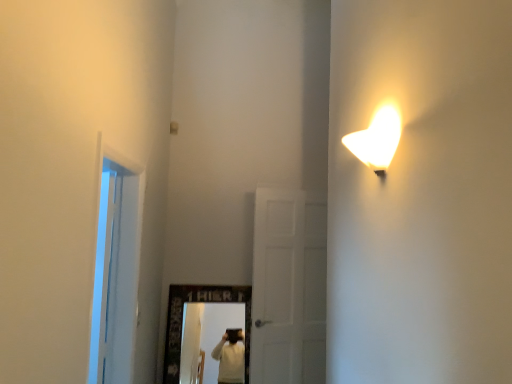
Where is `transparent glass door at left`? Image resolution: width=512 pixels, height=384 pixels. transparent glass door at left is located at coordinates (116, 271).

Measure the distance between point (124,378) and camera.

The distance of point (124,378) from camera is 7.94 feet.

Describe the element at coordinates (116, 271) in the screenshot. I see `transparent glass door at left` at that location.

Measure the distance between transparent glass door at left and camera.

The distance of transparent glass door at left from camera is 1.78 meters.

What is the approximate height of white matte door at center?

white matte door at center is 1.54 meters tall.

What do you see at coordinates (277, 286) in the screenshot?
I see `white matte door at center` at bounding box center [277, 286].

Find the location of a particular element. white matte door at center is located at coordinates (277, 286).

You are a GUI agent. You are given a task and a screenshot of the screen. Output one action in this format:
    pyautogui.click(x=<x>, y=<y>)
    Task: Click on the transparent glass door at left
    The height and width of the screenshot is (384, 512).
    Given the screenshot: What is the action you would take?
    pyautogui.click(x=116, y=271)

Which object is positioned more to the left, white matte door at center or transparent glass door at left?

transparent glass door at left is more to the left.

Does white matte door at center lie in front of transparent glass door at left?

No, white matte door at center is further to the viewer.

Which point is more forward, (300, 370) or (100, 286)?

The point (100, 286) is closer to the camera.

From the image's perspective, is white matte door at center positioned above or below transparent glass door at left?

white matte door at center is situated lower than transparent glass door at left in the image.

From the picture: From a real-world perspective, who is located lower, white matte door at center or transparent glass door at left?

white matte door at center is physically lower.

Which of these two, white matte door at center or transparent glass door at left, is thinner?

Thinner between the two is white matte door at center.

Considering the sizes of white matte door at center and transparent glass door at left in the image, is white matte door at center taller or shorter than transparent glass door at left?

In the image, white matte door at center appears to be taller than transparent glass door at left.

Between white matte door at center and transparent glass door at left, which one has smaller size?

With smaller size is white matte door at center.

Is white matte door at center situated inside transparent glass door at left or outside?

white matte door at center is not inside transparent glass door at left, it's outside.

Would you consider white matte door at center to be distant from transparent glass door at left?

Yes.

Is transparent glass door at left at the back of white matte door at center?

No.

What's the angular difference between white matte door at center and transparent glass door at left's facing directions?

73.5 degrees.

Where is `window located in front of the white matte door at center`? window located in front of the white matte door at center is located at coordinates (116, 271).

Does transparent glass door at left appear on the right side of white matte door at center?

In fact, transparent glass door at left is to the left of white matte door at center.

Relative to white matte door at center, is transparent glass door at left in front or behind?

In the image, transparent glass door at left appears in front of white matte door at center.

Which point is more distant from viewer, (97, 348) or (293, 311)?

The point (293, 311) is farther.

From the image's perspective, is transparent glass door at left on top of white matte door at center?

Correct, transparent glass door at left appears higher than white matte door at center in the image.

From a real-world perspective, between transparent glass door at left and white matte door at center, who is vertically lower?

From a 3D spatial view, white matte door at center is below.

Based on the photo, considering the sizes of transparent glass door at left and white matte door at center in the image, is transparent glass door at left wider or thinner than white matte door at center?

Considering their sizes, transparent glass door at left looks broader than white matte door at center.

Can you confirm if transparent glass door at left is taller than white matte door at center?

No, transparent glass door at left is not taller than white matte door at center.

Is transparent glass door at left smaller than white matte door at center?

Incorrect, transparent glass door at left is not smaller in size than white matte door at center.

Is transparent glass door at left positioned beyond the bounds of white matte door at center?

That's correct, transparent glass door at left is outside of white matte door at center.

From the picture: Is transparent glass door at left next to white matte door at center and touching it?

No, transparent glass door at left is not touching white matte door at center.

Could you tell me if transparent glass door at left is facing white matte door at center?

No, transparent glass door at left is not facing towards white matte door at center.

Based on the photo, how distant is transparent glass door at left from white matte door at center?

transparent glass door at left and white matte door at center are 3.73 feet apart.

The height and width of the screenshot is (384, 512). Identify the location of window on the left of white matte door at center. click(116, 271).

At what (x,y) coordinates should I click in order to perform the action: click on door below the transparent glass door at left (from the image's perspective). Please return your answer as a coordinate pair (x, y). The height and width of the screenshot is (384, 512). Looking at the image, I should click on (277, 286).

Where is `door behind the transparent glass door at left`? The image size is (512, 384). door behind the transparent glass door at left is located at coordinates (277, 286).